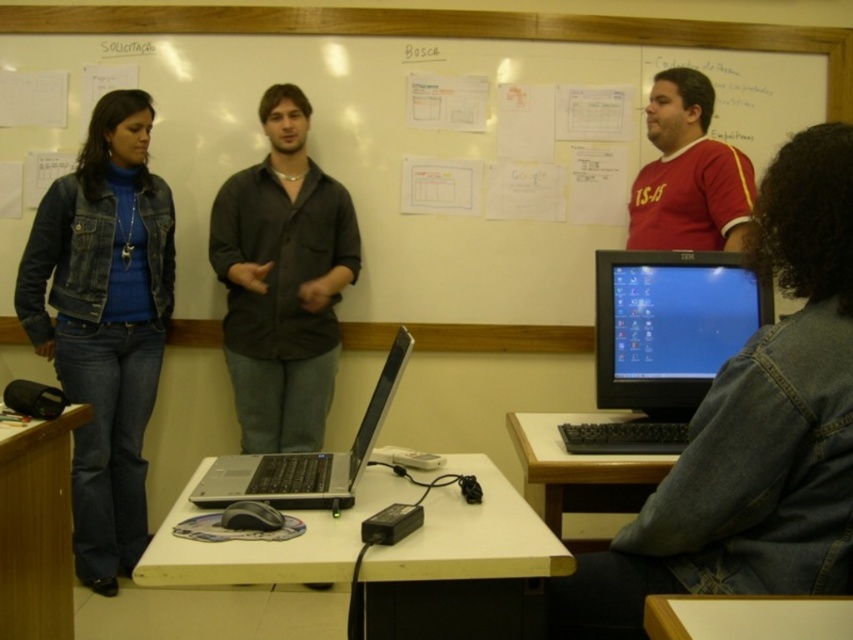
You are a student who needs to place a laptop on the table. You see the wooden desk at lower left and the white plastic table at lower right. Which table is closer to the left side of the classroom?

The wooden desk at lower left is positioned on the left side of white plastic table at lower right, so it is closer to the left side of the classroom.

From the picture: You are a student entering the classroom and see the denim jacket at lower right and the whiteboard at upper center. Which object is nearer to you as you stand at the entrance?

The denim jacket at lower right is closer to the viewer than the whiteboard at upper center, so the denim jacket at lower right is nearer to you.

You are a student in the classroom and need to place your laptop on the wooden desk at lower left. However, there is already a white wood table at lower right nearby. Which surface is closer to you?

The wooden desk at lower left is closer to you because it is located below the white wood table at lower right, meaning it is positioned nearer in the lower area of the scene.